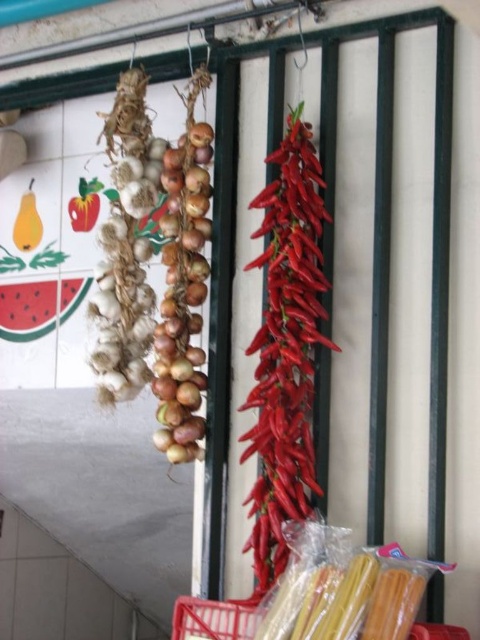
Is metallic red basket at lower center closer to the viewer compared to smooth red pepper at upper left?

Yes, it is in front of smooth red pepper at upper left.

Based on the photo, is metallic red basket at lower center shorter than smooth red pepper at upper left?

Yes, metallic red basket at lower center is shorter than smooth red pepper at upper left.

Is point (229, 605) in front of point (84, 221)?

Yes, point (229, 605) is closer to viewer.

Find the location of a particular element. Image resolution: width=480 pixels, height=640 pixels. metallic red basket at lower center is located at coordinates (212, 620).

Who is positioned more to the right, bright red pepper at center or smooth red pepper at upper left?

bright red pepper at center is more to the right.

Is bright red pepper at center positioned at the back of smooth red pepper at upper left?

That is False.

At what (x,y) coordinates should I click in order to perform the action: click on bright red pepper at center. Please return your answer as a coordinate pair (x, y). The image size is (480, 640). Looking at the image, I should click on (286, 349).

Which is more to the left, yellow matte pear at upper left or smooth red pepper at upper left?

yellow matte pear at upper left

Consider the image. Is yellow matte pear at upper left positioned at the back of smooth red pepper at upper left?

That is True.

Find the location of a particular element. This screenshot has height=640, width=480. yellow matte pear at upper left is located at coordinates (27, 221).